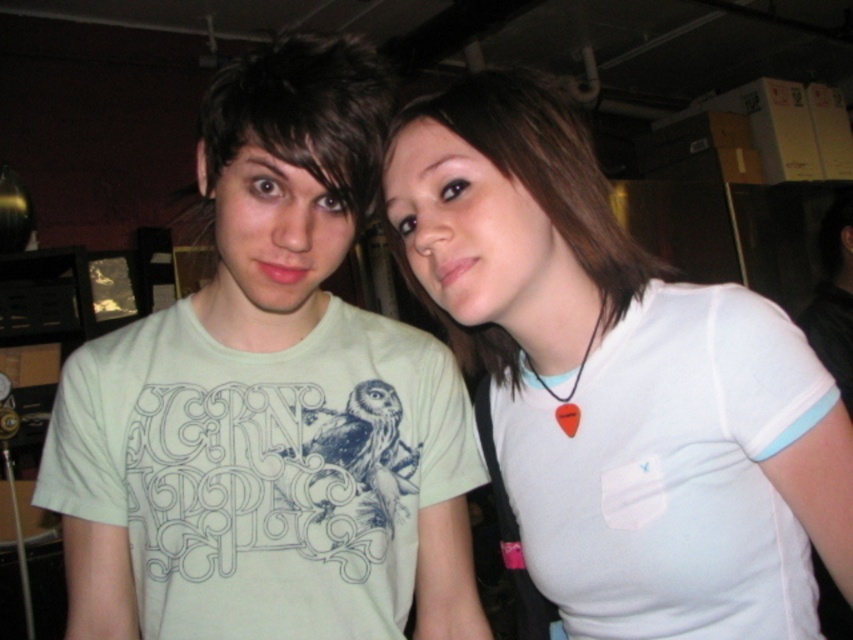
You are standing in the same room as the two people in the image. You want to reach both points marked in the scene. Which point, point (346,77) or point (708,628), will you reach first if you move directly towards them?

Point (346,77) is closer to the camera than point (708,628), so you will reach point (346,77) first since it is nearer to your current position.